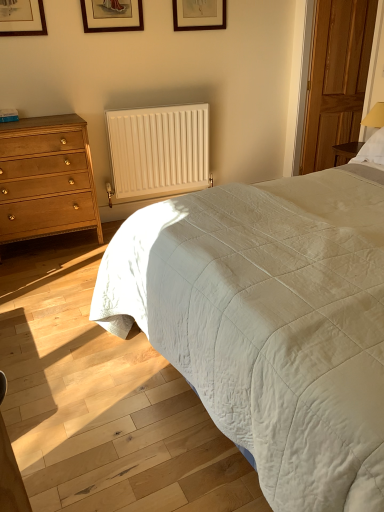
Question: Is white quilted bed at right bigger or smaller than wooden door at right?

Choices:
 (A) big
 (B) small

Answer: (A)

Question: From a real-world perspective, is white quilted bed at right positioned above or below wooden door at right?

Choices:
 (A) below
 (B) above

Answer: (A)

Question: Which of these objects is positioned farthest from the white matte radiator at center?

Choices:
 (A) wooden picture frame at upper center, placed as the second picture frame when sorted from back to front
 (B) matte wood chest of drawers at left
 (C) wooden picture frame at upper center, which ranks as the 1th picture frame in back-to-front order
 (D) white quilted bed at right
 (E) wooden door at right

Answer: (D)

Question: Which object is positioned closest to the wooden picture frame at upper center, placed as the second picture frame when sorted from back to front?

Choices:
 (A) wooden door at right
 (B) wooden picture frame at upper center, the second picture frame from the front
 (C) white matte radiator at center
 (D) matte wood chest of drawers at left
 (E) white quilted bed at right

Answer: (B)